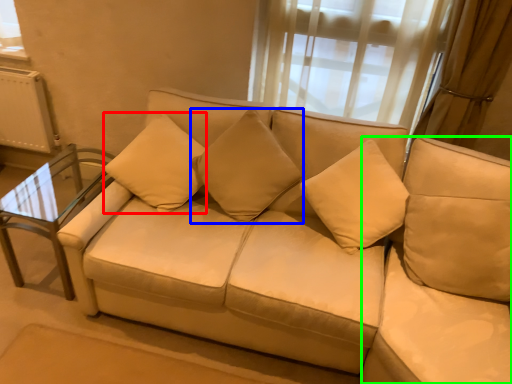
Question: Estimate the real-world distances between objects in this image. Which object is closer to pillow (highlighted by a red box), pillow (highlighted by a blue box) or beige (highlighted by a green box)?

Choices:
 (A) pillow
 (B) beige

Answer: (A)